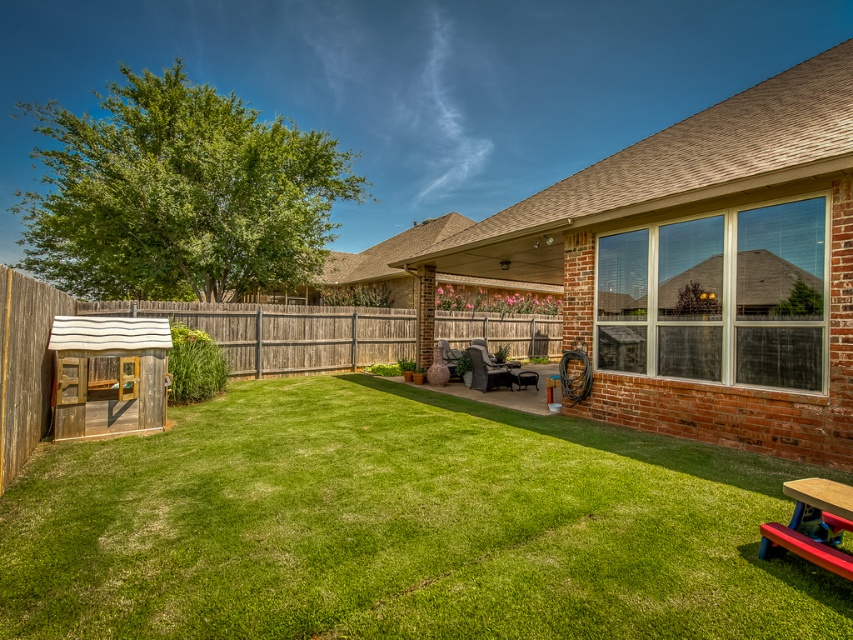
Question: Is green grass at center bigger than brown brick shed at center?

Choices:
 (A) no
 (B) yes

Answer: (A)

Question: Which point is farther to the camera?

Choices:
 (A) brown brick shed at center
 (B) green grass at center
 (C) red plastic picnic table at lower right

Answer: (A)

Question: Is green grass at center wider than brown brick shed at center?

Choices:
 (A) no
 (B) yes

Answer: (A)

Question: Which of the following is the farthest from the observer?

Choices:
 (A) (782, 547)
 (B) (120, 310)
 (C) (28, 314)

Answer: (B)

Question: Does wooden fence at center have a greater width compared to red plastic picnic table at lower right?

Choices:
 (A) yes
 (B) no

Answer: (A)

Question: Which of these objects is positioned closest to the green grass at center?

Choices:
 (A) brown brick shed at center
 (B) wooden fence at center

Answer: (A)